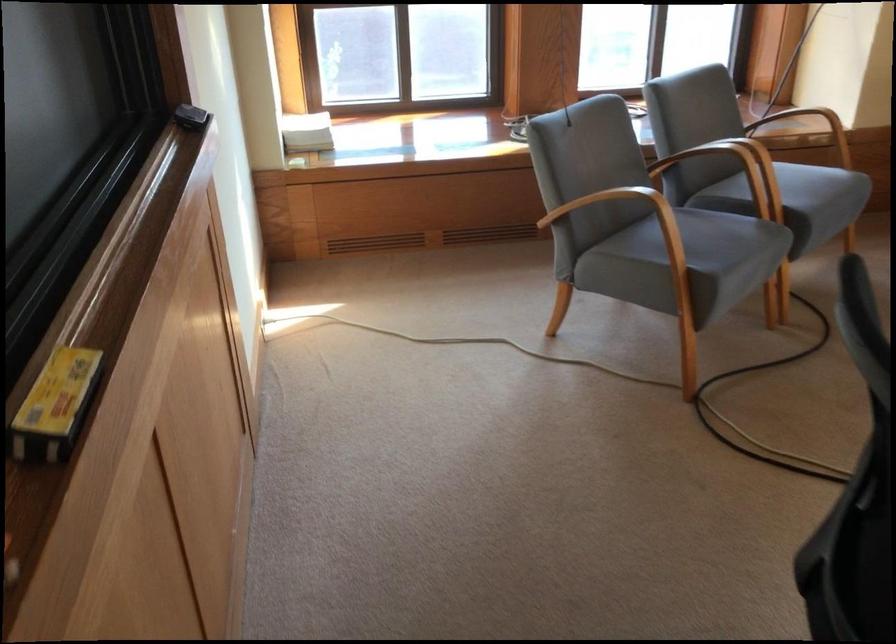
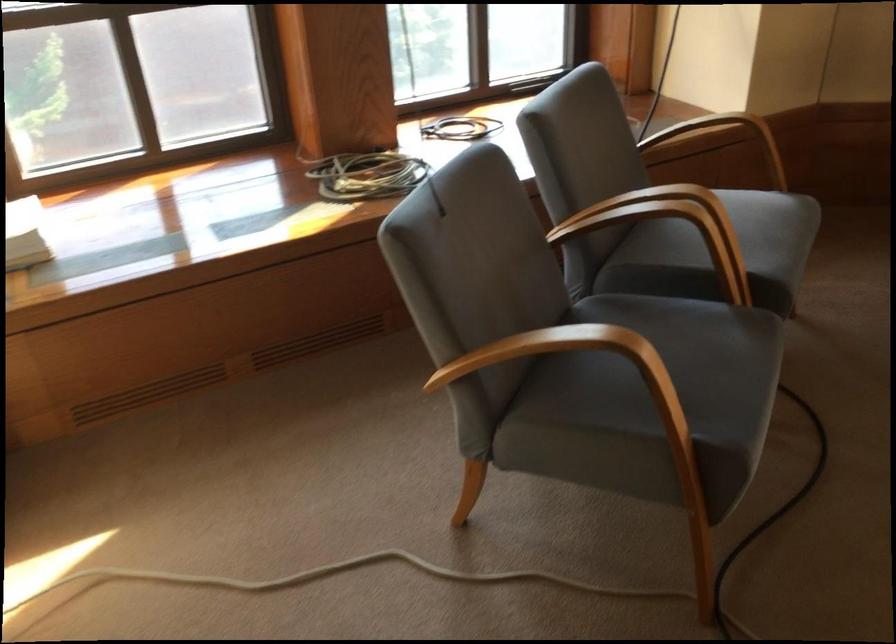
In the second image, find the point that corresponds to pixel 736 171 in the first image.

(664, 234)